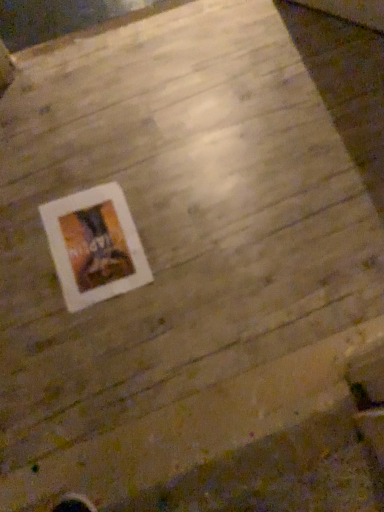
Find the location of a particular element. This screenshot has height=512, width=384. vacant space underneath white matte picture frame at center (from a real-world perspective) is located at coordinates (x=96, y=245).